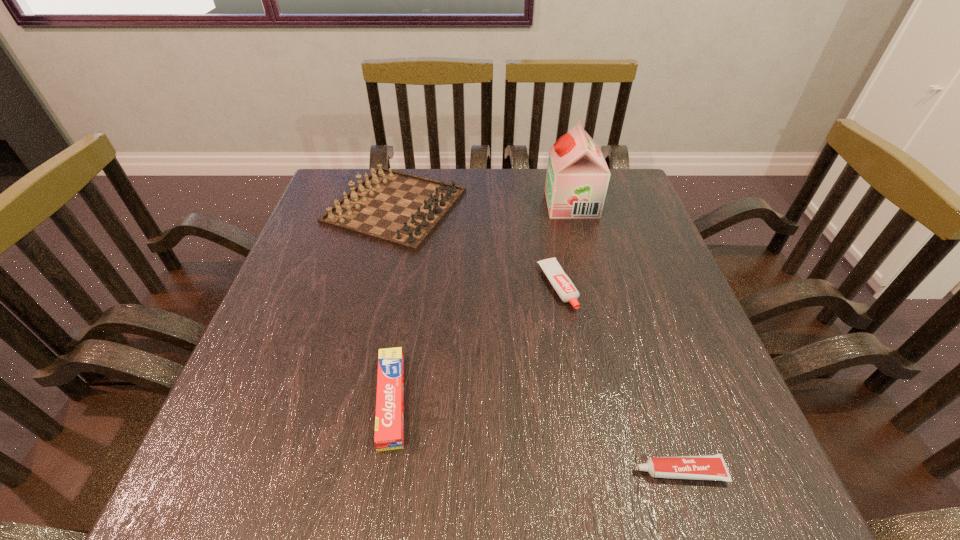
Where is `vacant point located between the soya milk and the chessboard`? vacant point located between the soya milk and the chessboard is located at coordinates (484, 205).

Where is `the second closest object to the rightmost toothpaste`? the second closest object to the rightmost toothpaste is located at coordinates (389, 421).

Where is `object that is the fourth nearest to the chessboard`? object that is the fourth nearest to the chessboard is located at coordinates (698, 467).

The width and height of the screenshot is (960, 540). In order to click on toothpaste that stands as the second closest to the farthest toothpaste in this screenshot , I will do `click(698, 467)`.

Locate an element on the screen. toothpaste that is the third closest to the soya milk is located at coordinates (698, 467).

Image resolution: width=960 pixels, height=540 pixels. What are the coordinates of `vacant area that satisfies the following two spatial constraints: 1. with the cap open on the tallest object; 2. on the front side of the second farthest toothpaste` in the screenshot? It's located at (622, 401).

What are the coordinates of `vacant area that satisfies the following two spatial constraints: 1. on the front side of the fourth shortest object; 2. on the left side of the farthest toothpaste` in the screenshot? It's located at click(x=376, y=286).

You are a GUI agent. You are given a task and a screenshot of the screen. Output one action in this format:
    pyautogui.click(x=<x>, y=<y>)
    Task: Click on the free space that satisfies the following two spatial constraints: 1. with the cap open on the tallest object; 2. on the front side of the third nearest object
    The image size is (960, 540).
    Given the screenshot: What is the action you would take?
    pyautogui.click(x=593, y=286)

Locate an element on the screen. The width and height of the screenshot is (960, 540). free point that satisfies the following two spatial constraints: 1. with the cap open on the tallest object; 2. on the front side of the leftmost toothpaste is located at coordinates (622, 401).